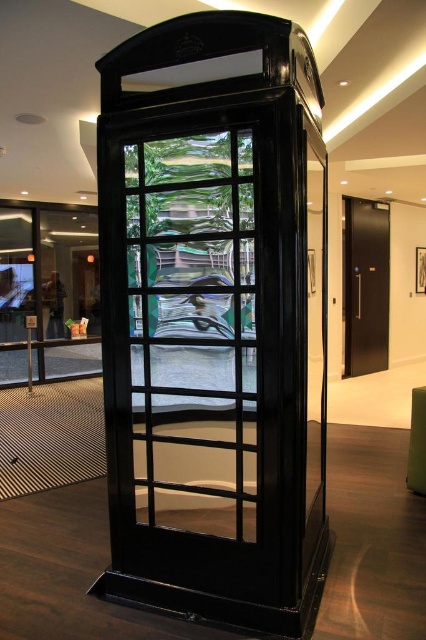
You are a maintenance worker needing to inspect the clear glass door at center and the black metal elevator at right. Given that your inspection equipment has a maximum range of 5 meters, can you perform the inspection without moving closer?

The distance between the clear glass door at center and the black metal elevator at right is 6.26 meters, which exceeds the 5 meters range of your equipment. Therefore, you cannot inspect both without moving closer.

You are standing in a hallway and see the clear glass door at center and the black metal elevator at right. Which object is nearer to you?

The clear glass door at center is closer to the viewer than the black metal elevator at right.

You are standing in front of the black telephone booth and want to locate the clear glass door at center. Based on the coordinates provided, can you determine its exact position?

The clear glass door at center is located at coordinates point (192, 332).